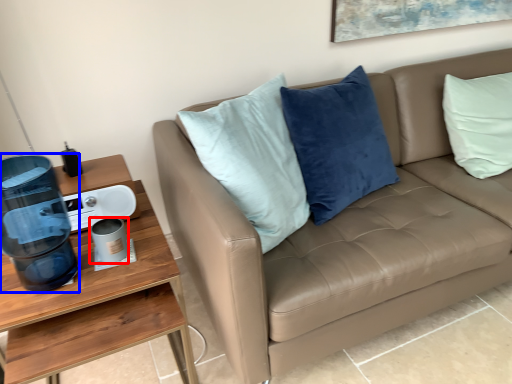
Question: Which object appears closest to the camera in this image, coffee cup (highlighted by a red box) or water cooler (highlighted by a blue box)?

Choices:
 (A) coffee cup
 (B) water cooler

Answer: (B)